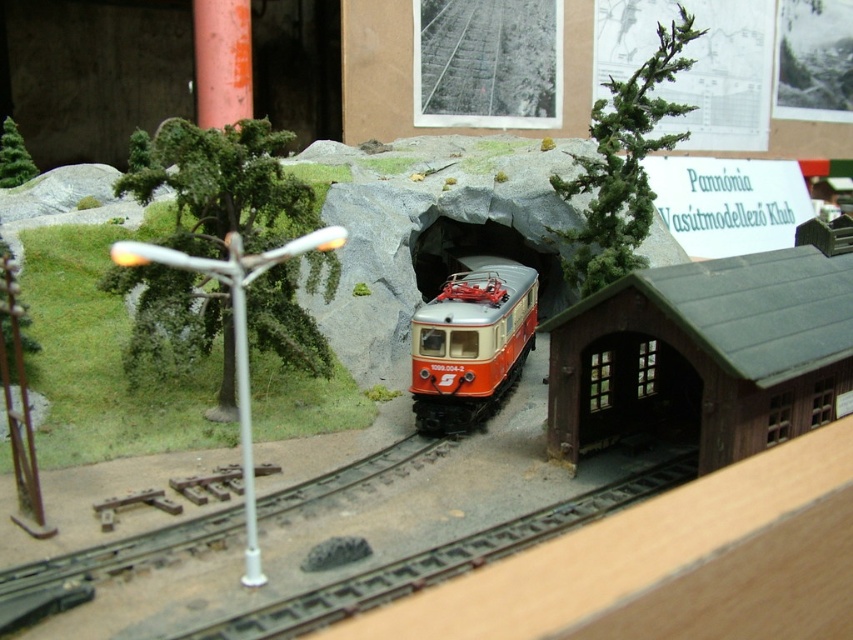
You are a model railway enthusiast examining the scene. You notice two trees, the green textured tree at left and the green textured pine tree at upper left. Which tree is taller?

The green textured tree at left is much taller than the green textured pine tree at upper left.

You are a model train enthusiast examining the diorama. You notice the green textured tree at left and the brown metal train track at lower center. Which object is positioned further to the east in the scene?

The green textured tree at left is positioned further to the east than the brown metal train track at lower center because it is located to the left of the track, and in the scene, left corresponds to the eastern direction.